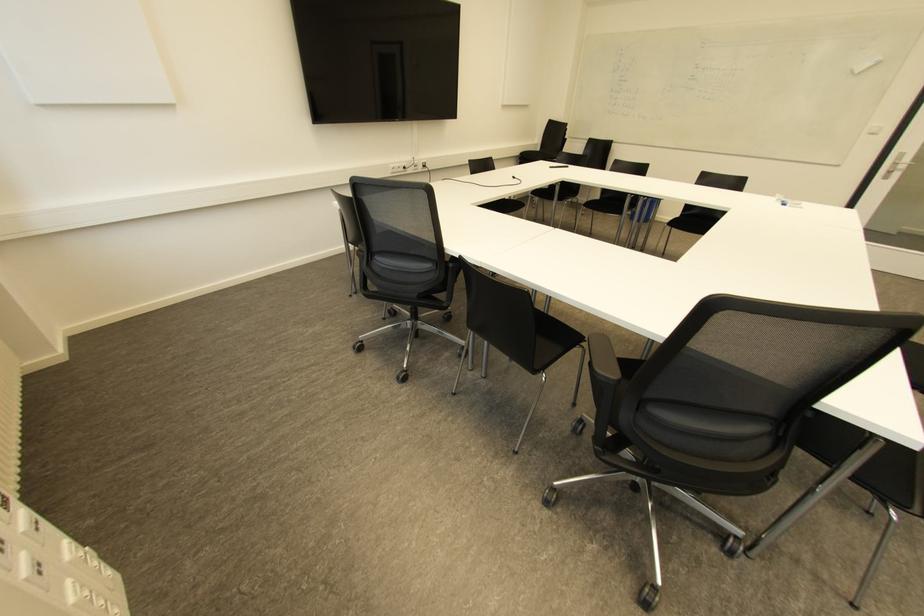
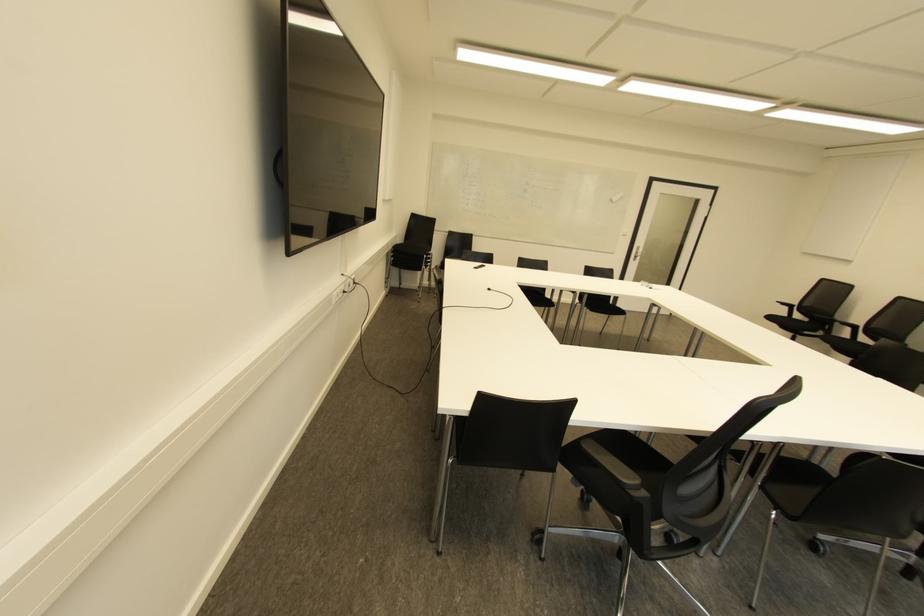
The point at (890, 172) is marked in the first image. Where is the corresponding point in the second image?

(636, 257)